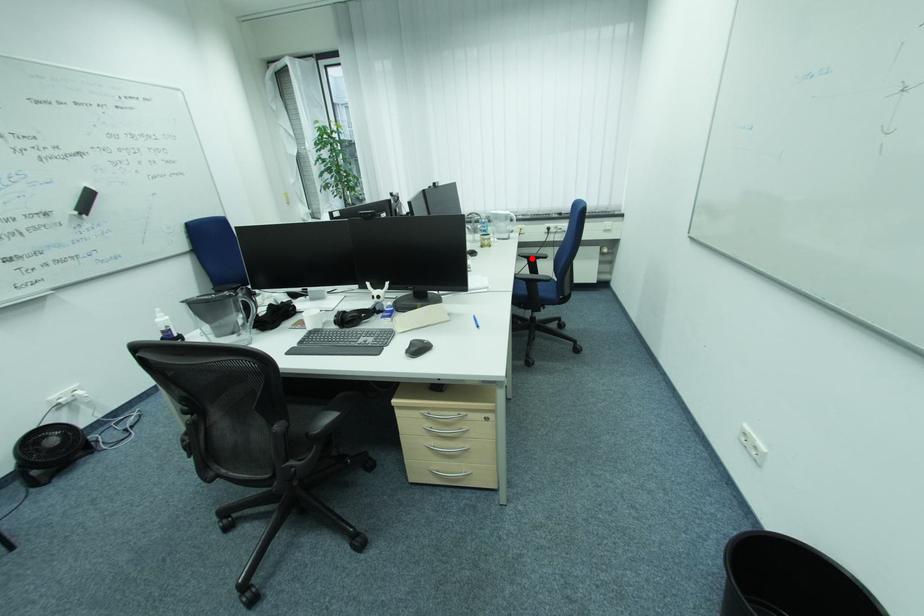
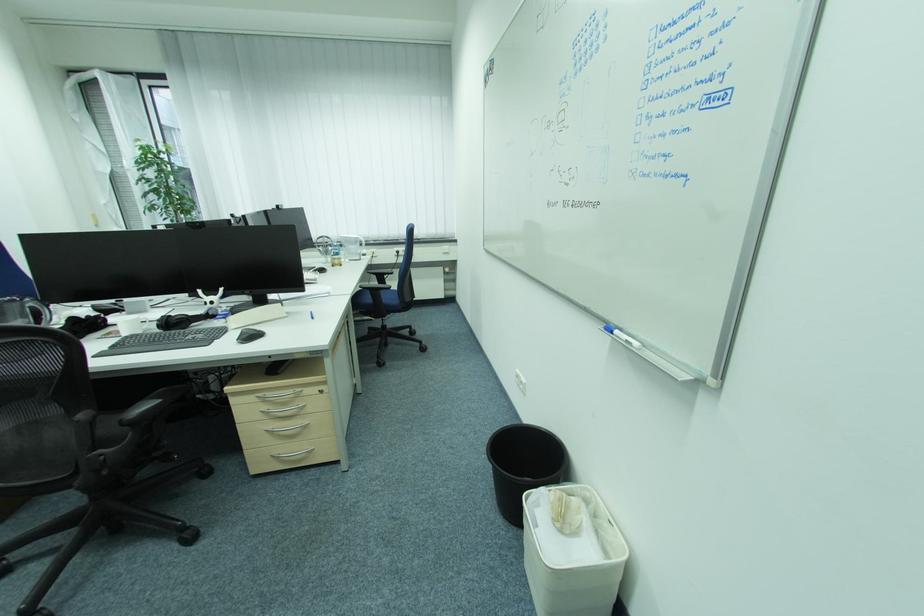
Question: I am providing you with two images of the same scene from different viewpoints. Image1 has a red point marked. In image2, the corresponding 3D location appears at what relative position? Reply with the corresponding letter.

Choices:
 (A) Closer
 (B) Farther

Answer: (A)